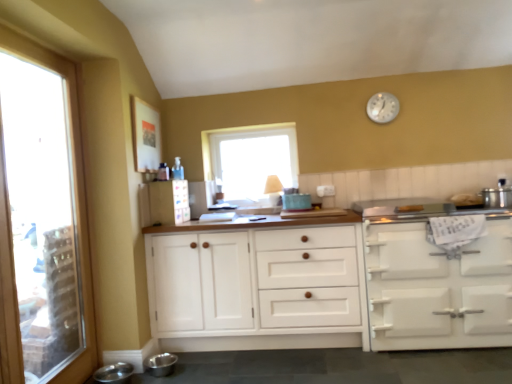
Where is `blank space situated above clear glass window at left, which ranks as the 1th window in left-to-right order (from a real-world perspective)`? This screenshot has height=384, width=512. blank space situated above clear glass window at left, which ranks as the 1th window in left-to-right order (from a real-world perspective) is located at coordinates 26,35.